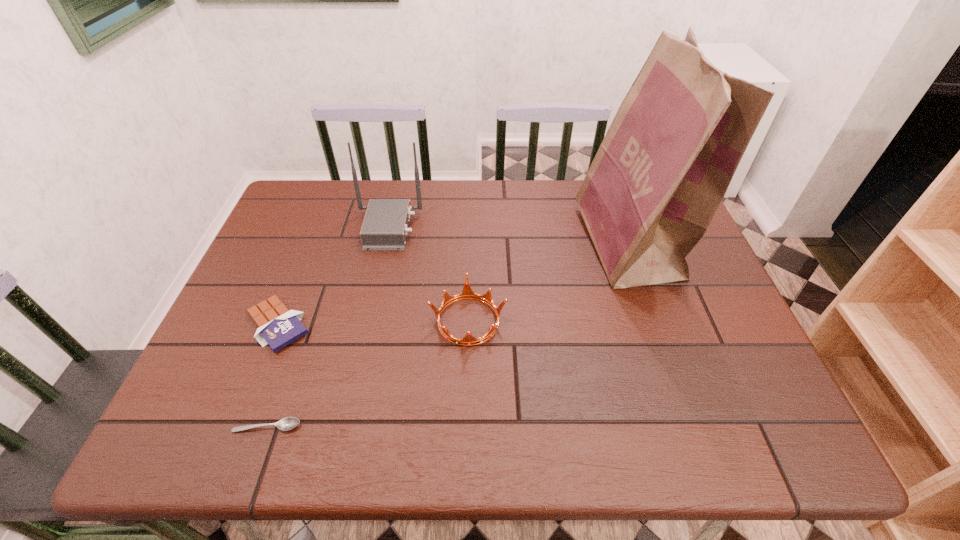
Locate an element on the screen. This screenshot has width=960, height=540. object present at the right edge is located at coordinates (662, 170).

Where is `object that is at the near left corner`? The height and width of the screenshot is (540, 960). object that is at the near left corner is located at coordinates (288, 423).

This screenshot has width=960, height=540. I want to click on object that is at the far right corner, so click(x=662, y=170).

You are a GUI agent. You are given a task and a screenshot of the screen. Output one action in this format:
    pyautogui.click(x=<x>, y=<y>)
    Task: Click on the vacant region at the far edge of the desktop
    The width and height of the screenshot is (960, 540).
    Given the screenshot: What is the action you would take?
    pyautogui.click(x=444, y=203)

You are a GUI agent. You are given a task and a screenshot of the screen. Output one action in this format:
    pyautogui.click(x=<x>, y=<y>)
    Task: Click on the vacant position at the near edge of the desktop
    The image size is (960, 540).
    Given the screenshot: What is the action you would take?
    pyautogui.click(x=612, y=427)

Locate an element on the screen. The image size is (960, 540). vacant space at the left edge is located at coordinates (278, 272).

You are a GUI agent. You are given a task and a screenshot of the screen. Output one action in this format:
    pyautogui.click(x=<x>, y=<y>)
    Task: Click on the blank space at the right edge of the desktop
    This screenshot has width=960, height=540.
    Given the screenshot: What is the action you would take?
    pyautogui.click(x=692, y=340)

You are a GUI agent. You are given a task and a screenshot of the screen. Output one action in this format:
    pyautogui.click(x=<x>, y=<y>)
    Task: Click on the blank space at the far left corner of the desktop
    
    Given the screenshot: What is the action you would take?
    pyautogui.click(x=286, y=215)

In the image, there is a desktop. Identify the location of vacant space at the near left corner. (198, 442).

Identify the location of free space that is in between the soupspoon and the fourth object from left to right. (368, 373).